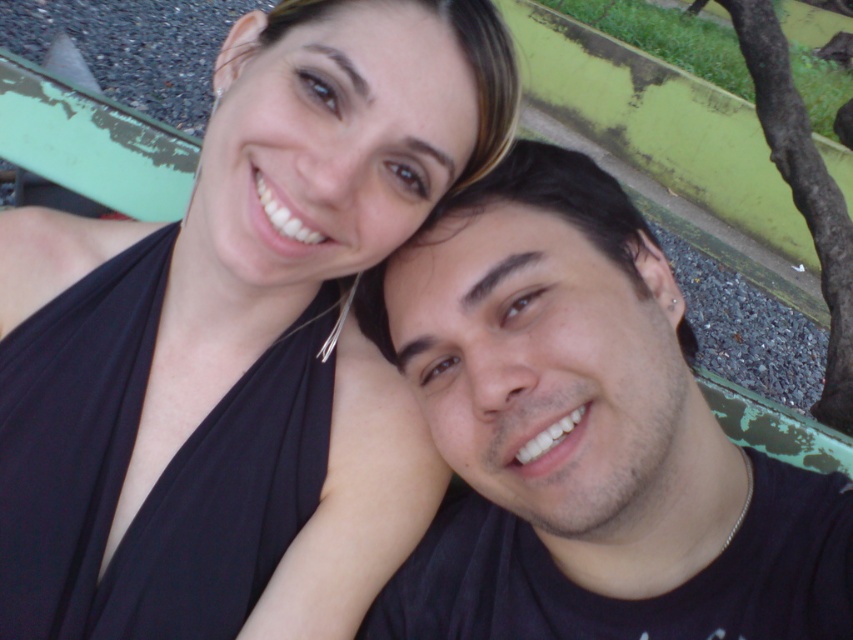
Looking at this image, which is above, black fabric at upper left or black matte shirt at center?

black fabric at upper left

Is black fabric at upper left positioned before black matte shirt at center?

Yes, black fabric at upper left is in front of black matte shirt at center.

Between point (210, 248) and point (467, 518), which one is positioned in front?

Point (210, 248) is more forward.

Find the location of a particular element. black fabric at upper left is located at coordinates (241, 342).